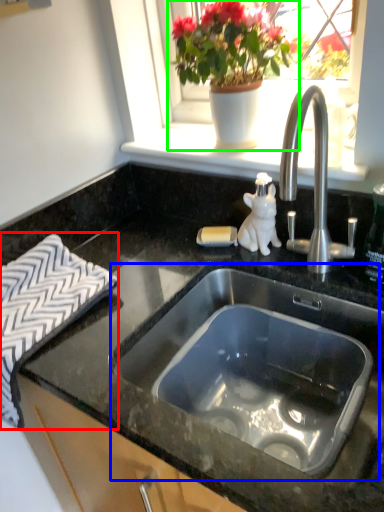
Question: Which object is the farthest from bath towel (highlighted by a red box)? Choose among these: sink (highlighted by a blue box) or houseplant (highlighted by a green box).

Choices:
 (A) sink
 (B) houseplant

Answer: (B)